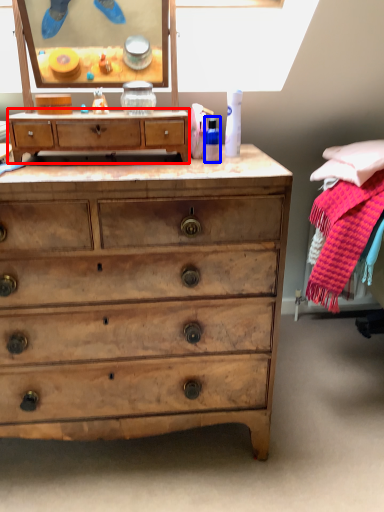
Question: Among these objects, which one is nearest to the camera, chest of drawers (highlighted by a red box) or toiletry (highlighted by a blue box)?

Choices:
 (A) chest of drawers
 (B) toiletry

Answer: (A)